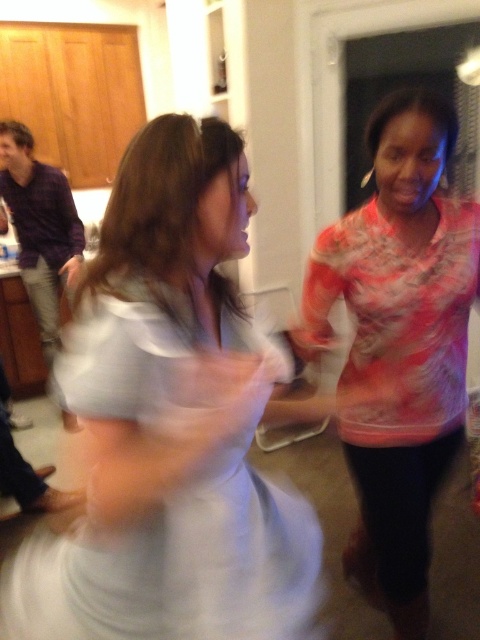
You are organizing a charity event and need to arrange two dresses on a display rack. The white satin dress at center and the multicolored sheer blouse at right. Which dress is wider and should be placed on the wider side of the rack?

The white satin dress at center is wider than the multicolored sheer blouse at right, so it should be placed on the wider side of the rack.

You are organizing a photo album and want to place the white satin dress at center and the multicolored sheer blouse at right side by side. Based on their sizes in the image, which one should you place first to ensure they fit properly?

The white satin dress at center occupies less space than the multicolored sheer blouse at right, so you should place the multicolored sheer blouse at right first to accommodate its larger size before arranging the smaller white satin dress at center.